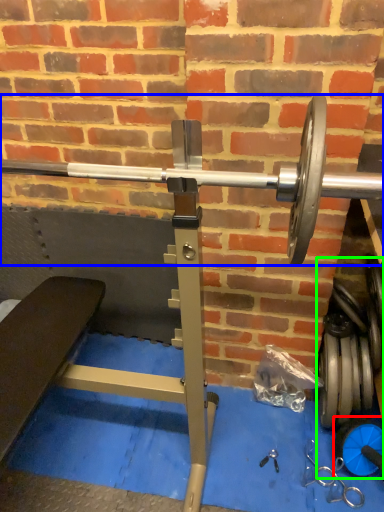
Question: Which is nearer to the dumbbell (highlighted by a red box)? barbell (highlighted by a blue box) or dumbbell (highlighted by a green box).

Choices:
 (A) barbell
 (B) dumbbell

Answer: (B)